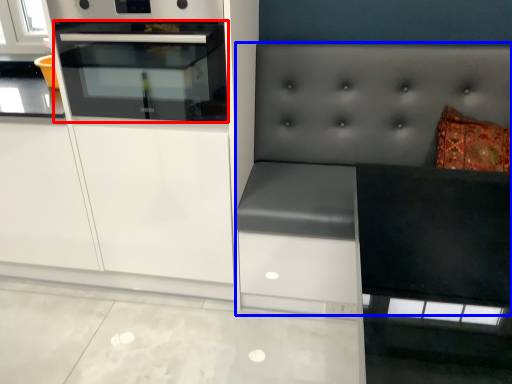
Question: Which point is further to the camera, oven (highlighted by a red box) or couch (highlighted by a blue box)?

Choices:
 (A) oven
 (B) couch

Answer: (A)